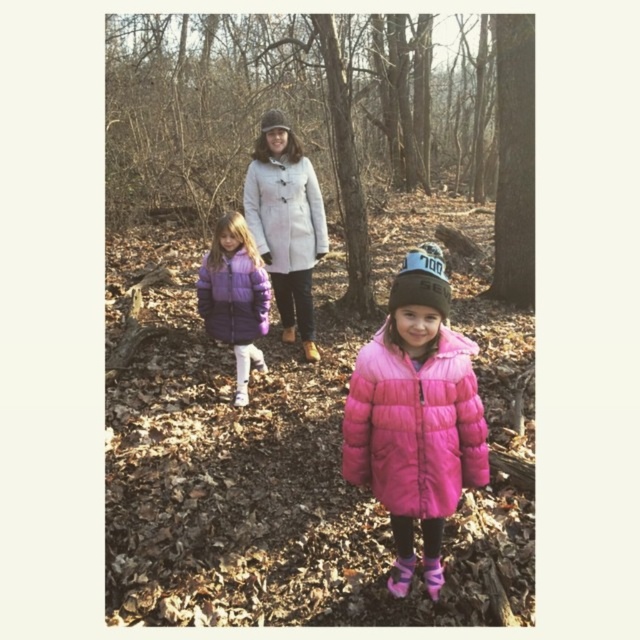
Question: Does pink puffy coat at center appear under brown suede boot at center?

Choices:
 (A) yes
 (B) no

Answer: (A)

Question: Which of the following is the closest to the observer?

Choices:
 (A) purple down jacket at center
 (B) pink matte boot at lower center

Answer: (B)

Question: Estimate the real-world distances between objects in this image. Which object is farther from the white woolen coat at center?

Choices:
 (A) pink matte boot at lower center
 (B) purple down jacket at center
 (C) light gray wool coat at center
 (D) leather boot at center

Answer: (A)

Question: Can you confirm if puffy purple coat at center is smaller than pink matte boot at lower center?

Choices:
 (A) yes
 (B) no

Answer: (B)

Question: Considering the real-world distances, which object is closest to the pink puffy coat at center?

Choices:
 (A) brown suede boot at center
 (B) leather boot at center
 (C) light gray wool coat at center

Answer: (C)

Question: Can you confirm if white woolen coat at center is positioned to the left of pink matte boot at lower right?

Choices:
 (A) yes
 (B) no

Answer: (A)